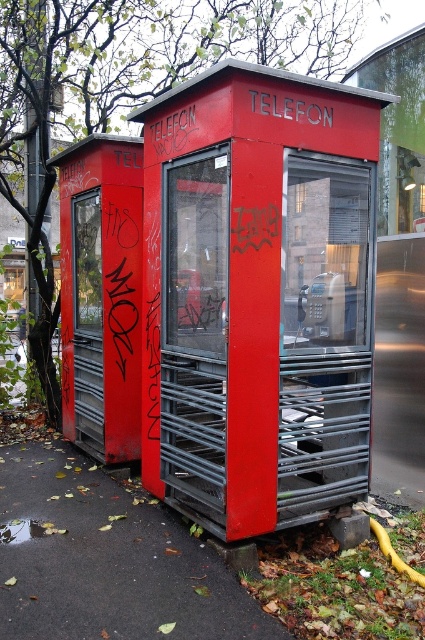
Which is in front, point (357, 262) or point (317, 330)?

Point (357, 262)

Is matte red telephone booth at center further to camera compared to metallic gray telephone at center?

No, matte red telephone booth at center is in front of metallic gray telephone at center.

What do you see at coordinates (255, 296) in the screenshot? The width and height of the screenshot is (425, 640). I see `matte red telephone booth at center` at bounding box center [255, 296].

You are a GUI agent. You are given a task and a screenshot of the screen. Output one action in this format:
    pyautogui.click(x=<x>, y=<y>)
    Task: Click on the matte red telephone booth at center
    
    Given the screenshot: What is the action you would take?
    pyautogui.click(x=255, y=296)